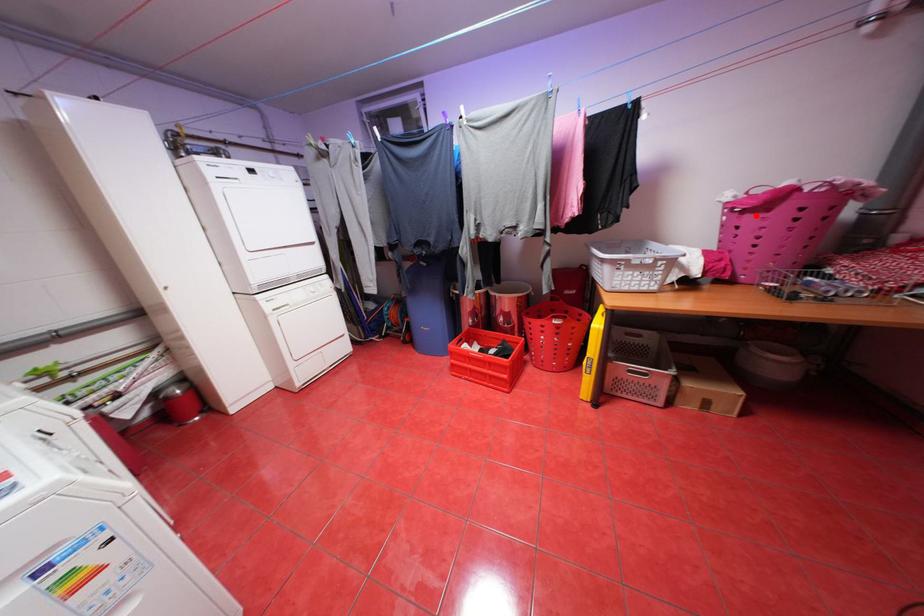
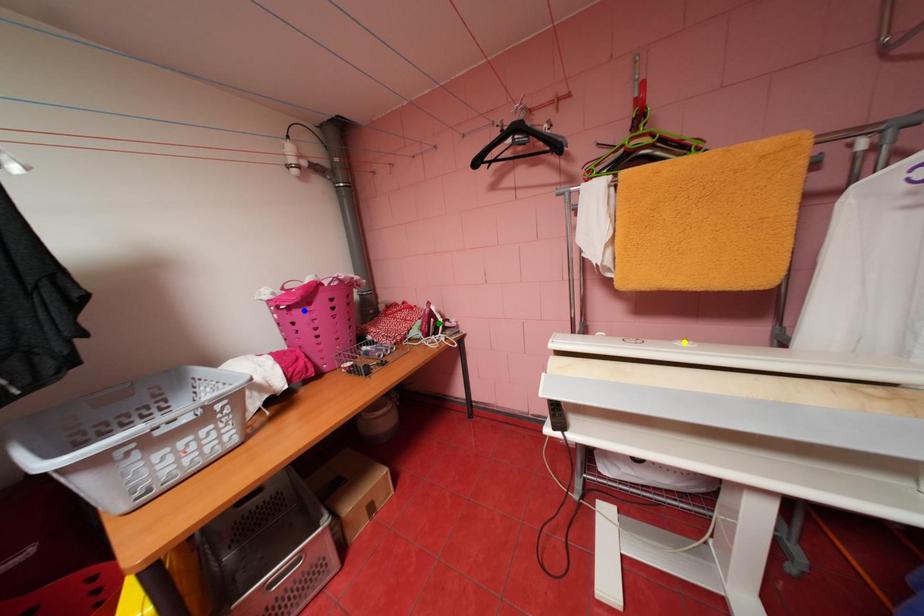
Question: I am providing you with two images of the same scene from different viewpoints. A red point is marked on the first image. You are given multiple points on the second image. Which point in image 2 is actually the same real-world point as the red point in image 1?

Choices:
 (A) blue point
 (B) green point
 (C) yellow point

Answer: (A)